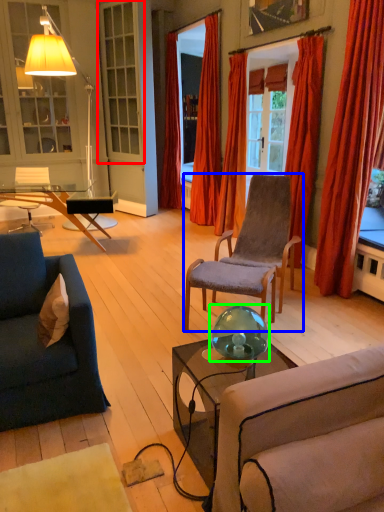
Question: Considering the real-world distances, which object is farthest from window (highlighted by a red box)? chair (highlighted by a blue box) or teal (highlighted by a green box)?

Choices:
 (A) chair
 (B) teal

Answer: (B)